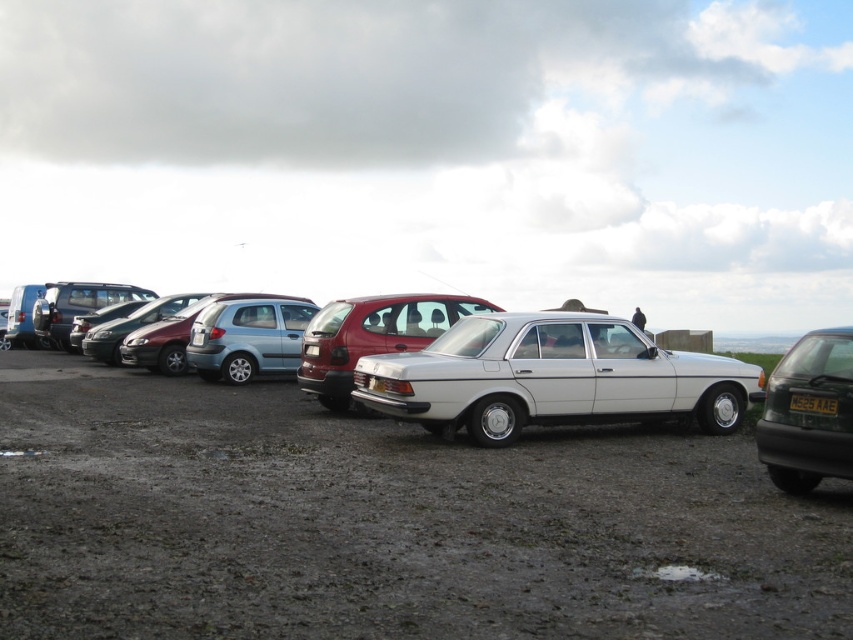
You are a parking attendant who needs to fit a new car into the parking lot. The new car is wider than the metallic blue sedan at center. Can you park the new car in the same space as the metallic red hatchback at center?

The metallic red hatchback at center is wider than the metallic blue sedan at center. Since the new car is wider than the metallic blue sedan at center, it might still fit in the space if the red hatchback at center has enough width. However, without knowing the exact width difference between the new car and the red hatchback, it is uncertain. The answer is inconclusive based on the given information.

You are standing in the parking area and see two points marked on the ground. The first point is at coordinate point [321,362] and the second is at point [285,339]. Which point is closer to you?

Point [321,362] is closer to the viewer than point [285,339].